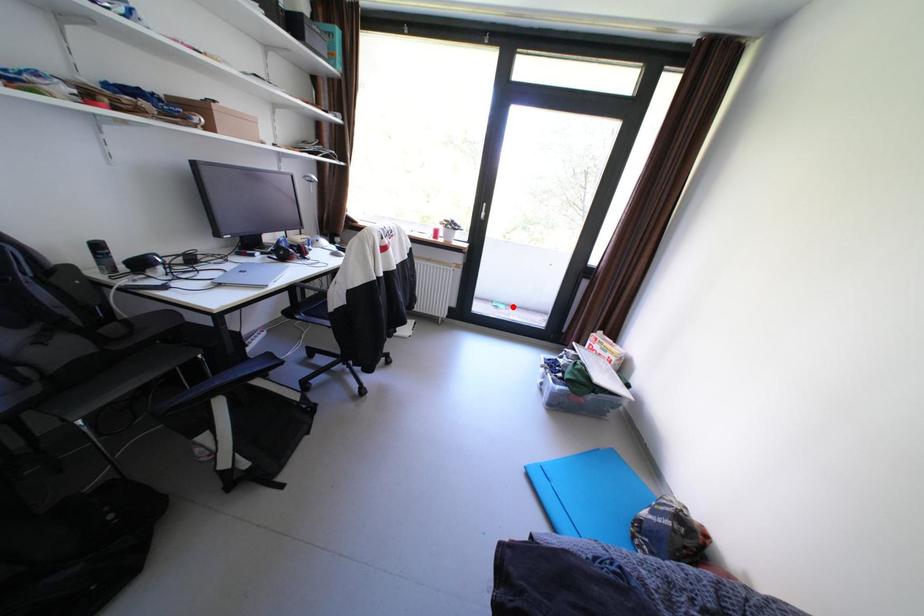
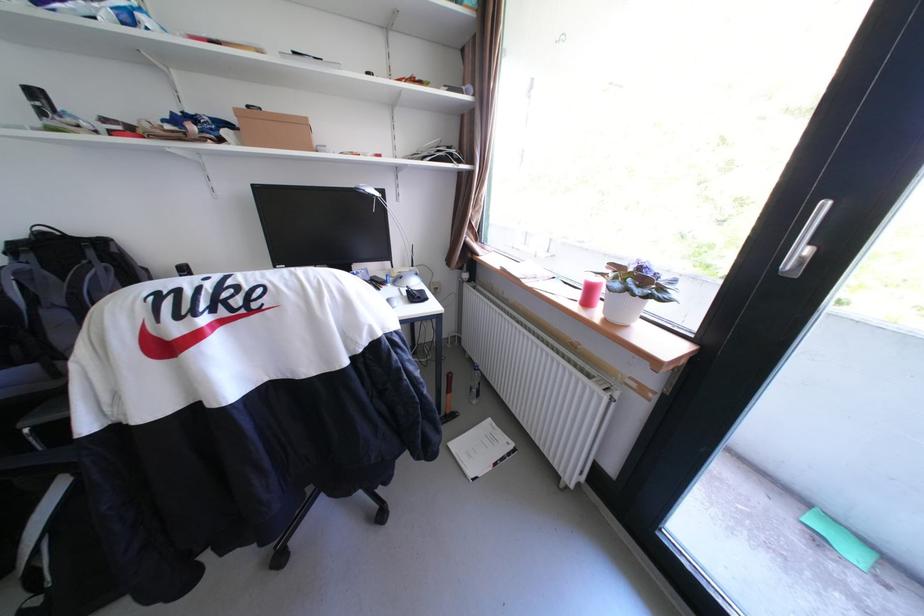
Question: I am providing you with two images of the same scene from different viewpoints. Image1 has a red point marked. In image2, the corresponding 3D location appears at what relative position? Reply with the corresponding letter.

Choices:
 (A) Closer
 (B) Farther

Answer: (B)